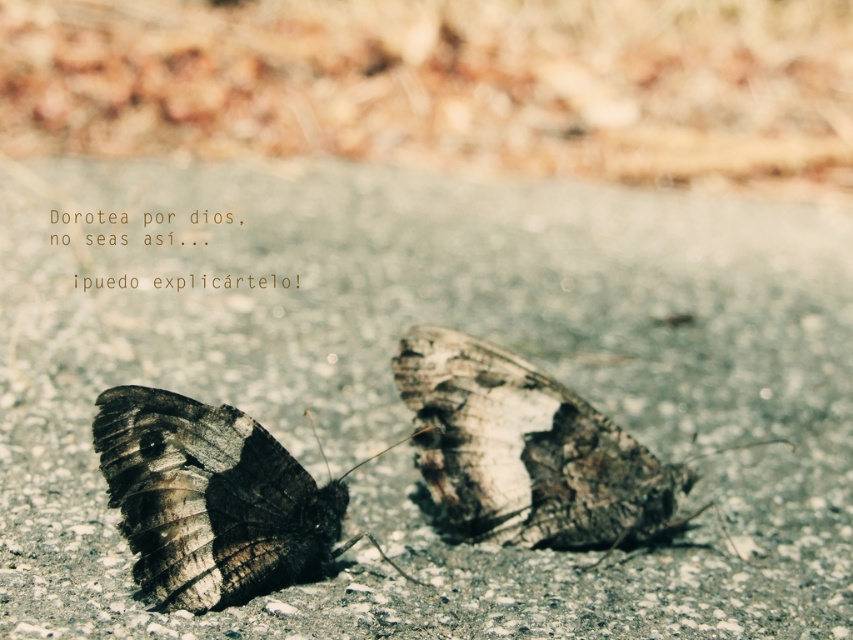
You are a photographer aiming to capture a closeup of the brown textured butterfly at center. Given the coordinates provided in the scene, can you confirm if the point marked at (525, 451) is the correct location for focusing your camera lens?

Yes, the point marked at (525, 451) is the correct location for focusing your camera lens as it marks the brown textured butterfly at center.

You are an entomologist observing two butterflies in a natural setting. You notice the brown textured butterfly at center and the dark brown textured butterfly at lower left. Which butterfly is positioned higher in the image?

The brown textured butterfly at center is positioned higher than the dark brown textured butterfly at lower left.

You are standing at the point closest to you in the image. There are two points marked in the scene, one at point (508, 406) and the other at point (146, 556). Which point is farther away from your current position?

Point (508, 406) is behind point (146, 556), so the point farther away from your current position is point (508, 406).